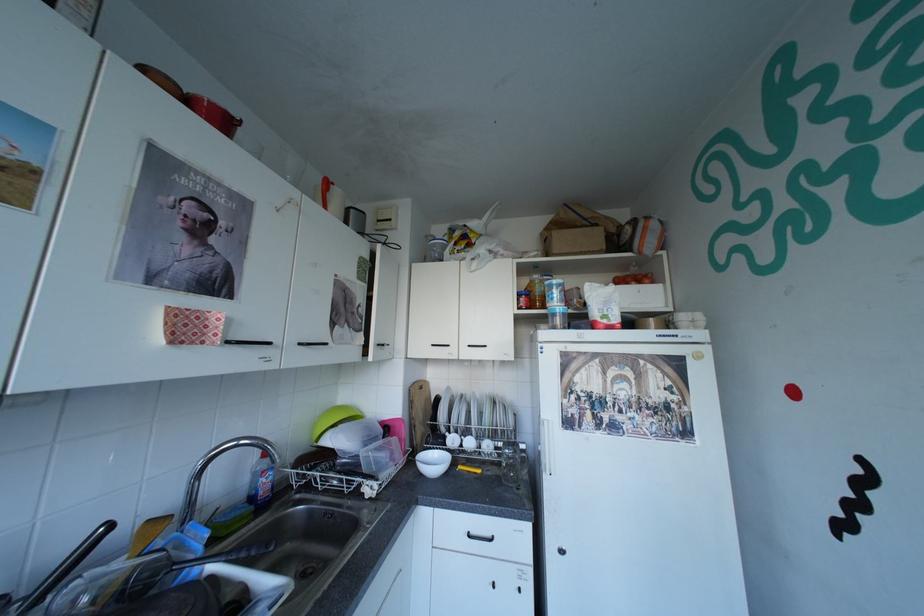
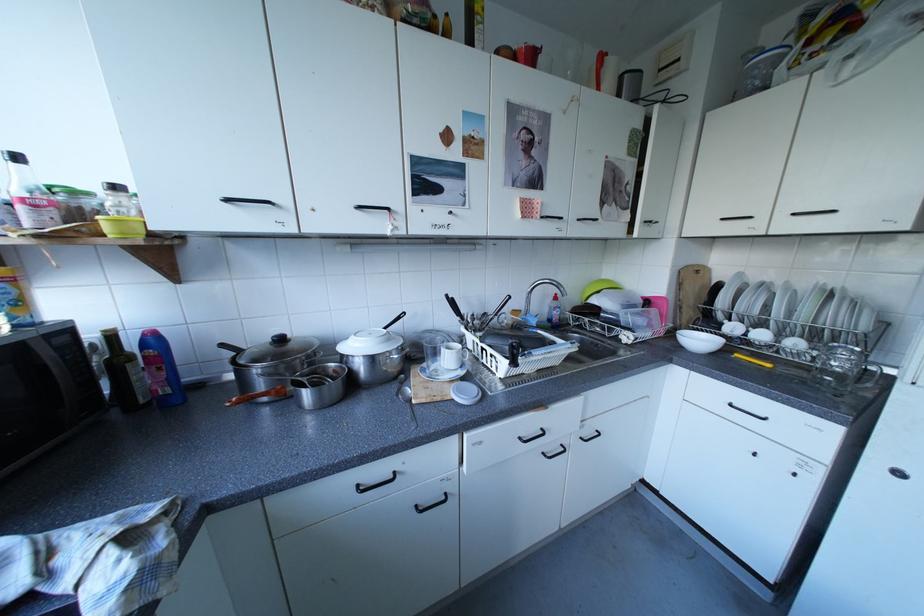
In the second image, find the point that corresponds to the point at 259,480 in the first image.

(558, 310)